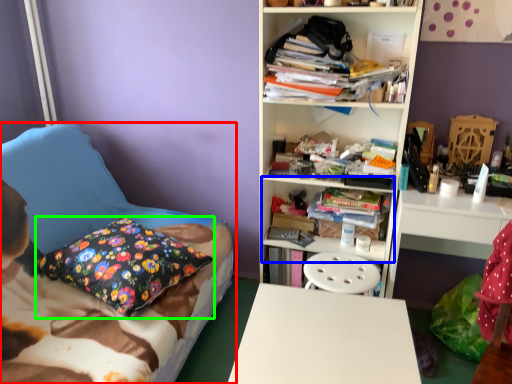
Question: Which object is positioned closest to bed (highlighted by a red box)? Select from cabinet (highlighted by a blue box) and pillow (highlighted by a green box).

Choices:
 (A) cabinet
 (B) pillow

Answer: (B)